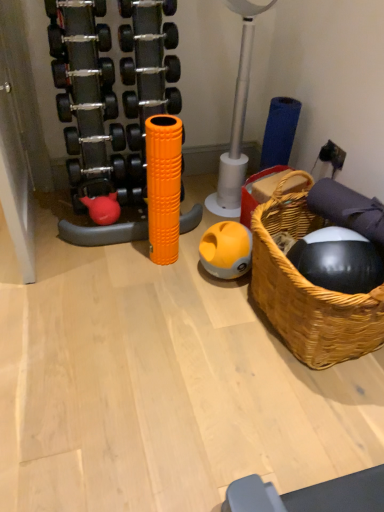
Image resolution: width=384 pixels, height=512 pixels. In order to click on free space on the front side of orange foam roller at center in this screenshot , I will do `click(168, 278)`.